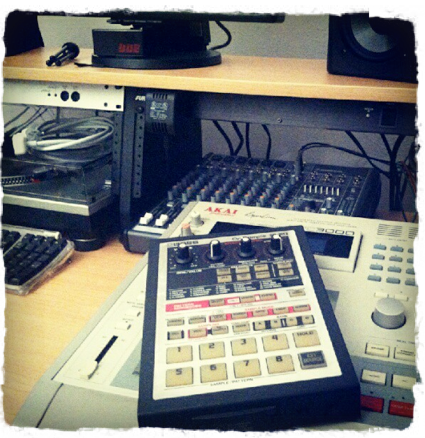
Identify the location of wall in background. (288, 37).